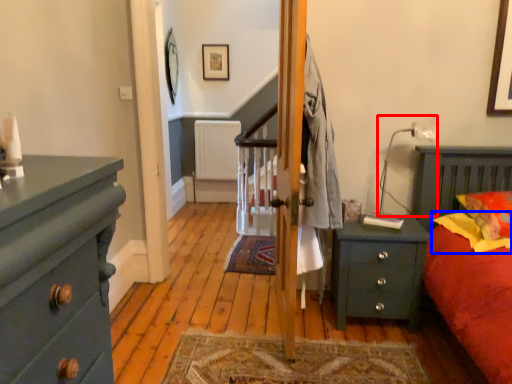
Question: Which of the following is the farthest to the observer, lamp (highlighted by a red box) or pillow (highlighted by a blue box)?

Choices:
 (A) lamp
 (B) pillow

Answer: (A)